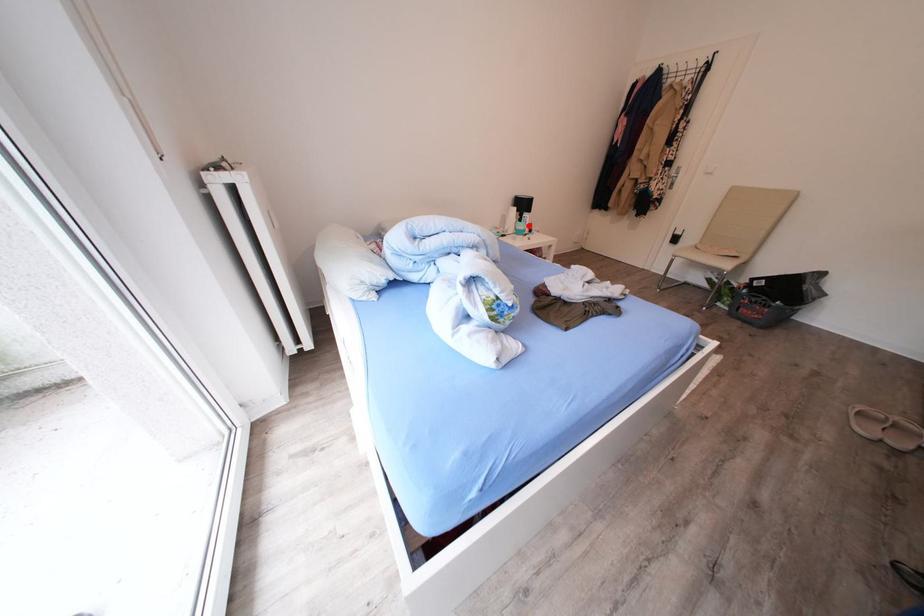
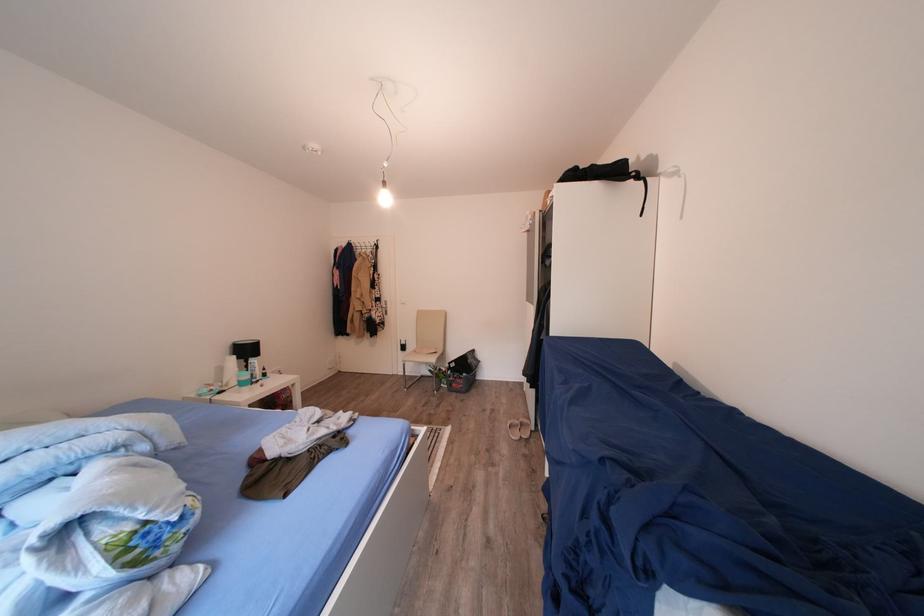
In the second image, find the point that corresponds to the highlighted location in the first image.

(256, 371)